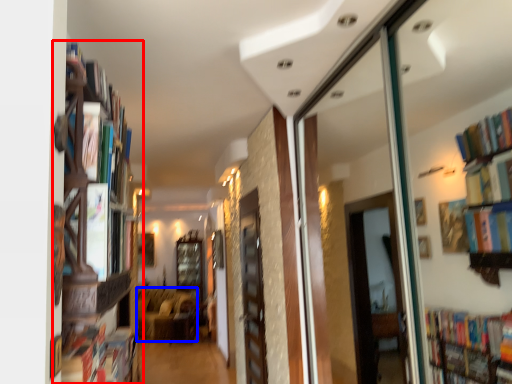
Question: Among these objects, which one is farthest to the camera, bookcase (highlighted by a red box) or furniture (highlighted by a blue box)?

Choices:
 (A) bookcase
 (B) furniture

Answer: (B)